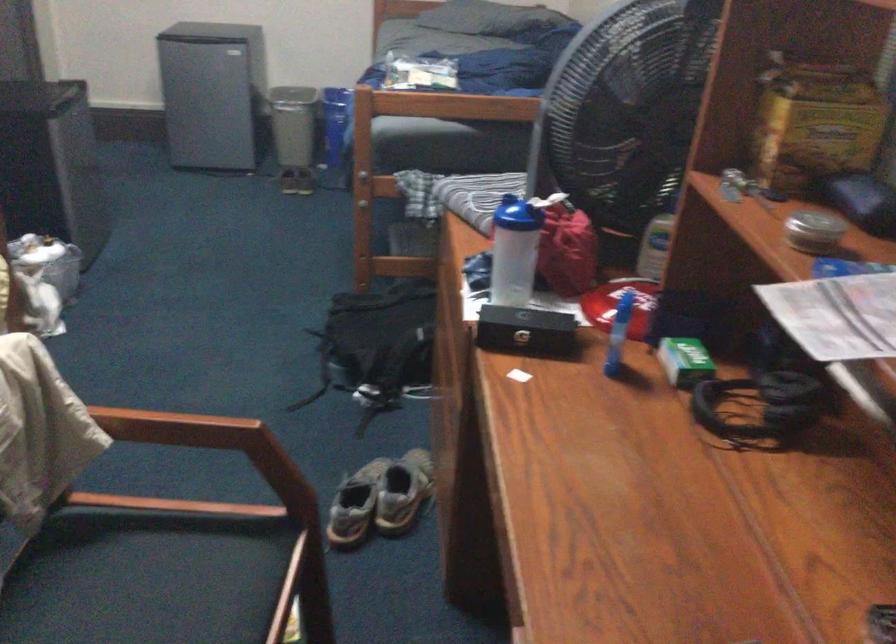
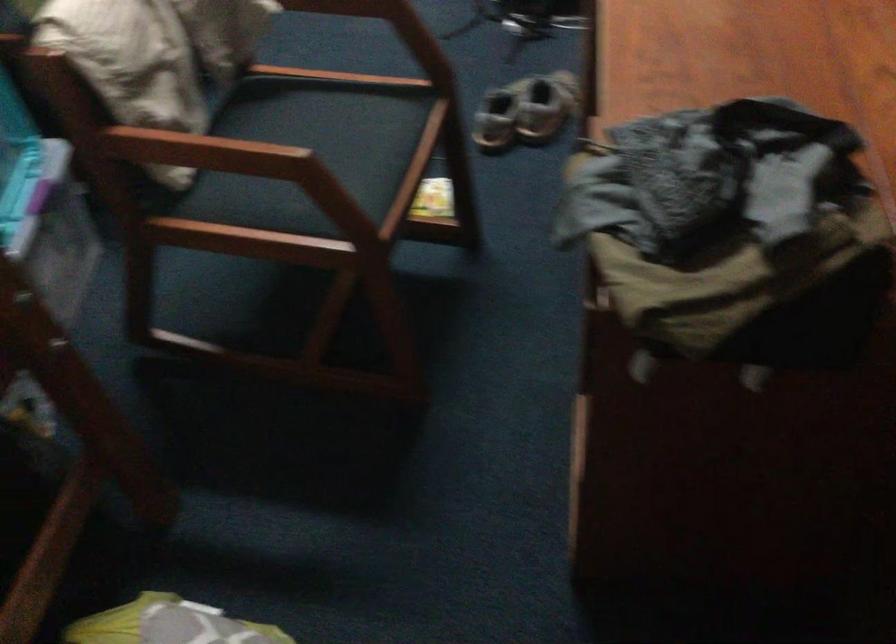
Question: The images are taken continuously from a first-person perspective. In which direction is your viewpoint rotating?

Choices:
 (A) Left
 (B) Right
 (C) Up
 (D) Down

Answer: (D)